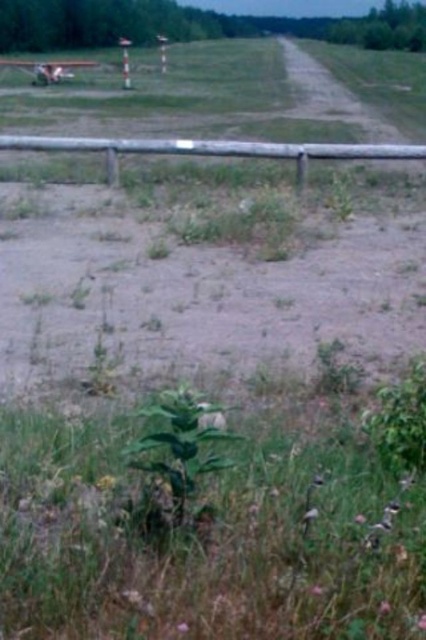
Question: Which of the following is the closest to the observer?

Choices:
 (A) (386, 577)
 (B) (160, 140)
 (C) (149, 458)

Answer: (A)

Question: Is green leafy plant at center positioned behind brown wooden fence at center?

Choices:
 (A) no
 (B) yes

Answer: (A)

Question: Which object appears farthest from the camera in this image?

Choices:
 (A) green leafy grass at center
 (B) brown wooden fence at center
 (C) green leafy plant at center

Answer: (B)

Question: Considering the relative positions of green leafy plant at center and brown wooden fence at center in the image provided, where is green leafy plant at center located with respect to brown wooden fence at center?

Choices:
 (A) right
 (B) left

Answer: (A)

Question: Can you confirm if green leafy grass at center is positioned to the left of green leafy plant at center?

Choices:
 (A) no
 (B) yes

Answer: (A)

Question: Which object is the farthest from the brown wooden fence at center?

Choices:
 (A) green leafy plant at center
 (B) green leafy grass at center

Answer: (A)